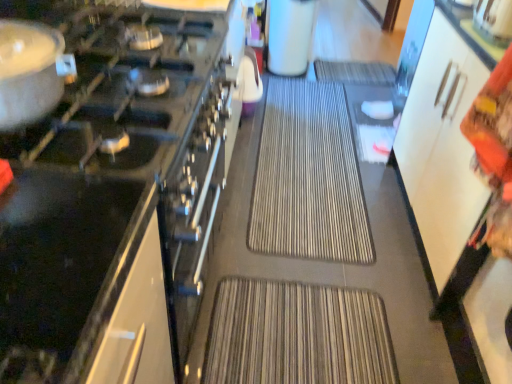
Question: Is metallic silver kettle at upper right, which appears as the 2th appliance when viewed from the top, surrounding white matte coffee maker at upper center, which is the first appliance from top to bottom?

Choices:
 (A) no
 (B) yes

Answer: (A)

Question: Is metallic silver kettle at upper right, the 2th appliance positioned from the bottom, positioned in front of white matte coffee maker at upper center, the third appliance ordered from the bottom?

Choices:
 (A) no
 (B) yes

Answer: (B)

Question: Is metallic silver kettle at upper right, the second appliance from the back, oriented away from white matte coffee maker at upper center, acting as the first appliance starting from the back?

Choices:
 (A) yes
 (B) no

Answer: (B)

Question: Can you confirm if metallic silver kettle at upper right, the 2th appliance positioned from the bottom, is wider than white matte coffee maker at upper center, the second appliance positioned from the left?

Choices:
 (A) yes
 (B) no

Answer: (B)

Question: Considering the relative sizes of metallic silver kettle at upper right, which appears as the third appliance when viewed from the left, and white matte coffee maker at upper center, acting as the first appliance starting from the back, in the image provided, is metallic silver kettle at upper right, which appears as the third appliance when viewed from the left, smaller than white matte coffee maker at upper center, acting as the first appliance starting from the back,?

Choices:
 (A) yes
 (B) no

Answer: (A)

Question: Considering the positions of matte silver pot at left and white matte coffee maker at upper center, the second appliance positioned from the left, in the image, is matte silver pot at left taller or shorter than white matte coffee maker at upper center, the second appliance positioned from the left,?

Choices:
 (A) short
 (B) tall

Answer: (A)

Question: Considering their positions, is matte silver pot at left located in front of or behind white matte coffee maker at upper center, acting as the first appliance starting from the back?

Choices:
 (A) front
 (B) behind

Answer: (A)

Question: From the image's perspective, is matte silver pot at left located above or below white matte coffee maker at upper center, which is the first appliance from top to bottom?

Choices:
 (A) below
 (B) above

Answer: (A)

Question: Looking at the image, does matte silver pot at left seem bigger or smaller compared to white matte coffee maker at upper center, which appears as the 2th appliance when viewed from the right?

Choices:
 (A) big
 (B) small

Answer: (B)

Question: Considering their positions, is metallic silver kettle at upper right, the first appliance positioned from the right, located in front of or behind brown textured mat at center?

Choices:
 (A) front
 (B) behind

Answer: (A)

Question: In terms of size, does metallic silver kettle at upper right, the second appliance from the back, appear bigger or smaller than brown textured mat at center?

Choices:
 (A) big
 (B) small

Answer: (B)

Question: Which is correct: metallic silver kettle at upper right, which ranks as the 2th appliance in front-to-back order, is inside brown textured mat at center, or outside of it?

Choices:
 (A) inside
 (B) outside

Answer: (B)

Question: Considering the positions of metallic silver kettle at upper right, which appears as the 2th appliance when viewed from the top, and brown textured mat at center in the image, is metallic silver kettle at upper right, which appears as the 2th appliance when viewed from the top, wider or thinner than brown textured mat at center?

Choices:
 (A) thin
 (B) wide

Answer: (A)

Question: Considering the relative positions of brown textured mat at center and white matte coffee maker at upper center, the third appliance in the front-to-back sequence, in the image provided, is brown textured mat at center to the left or to the right of white matte coffee maker at upper center, the third appliance in the front-to-back sequence,?

Choices:
 (A) right
 (B) left

Answer: (A)

Question: Is point (352, 233) closer or farther from the camera than point (286, 52)?

Choices:
 (A) closer
 (B) farther

Answer: (A)